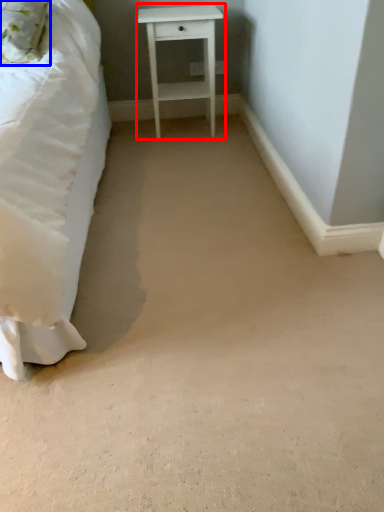
Question: Which object is closer to the camera taking this photo, nightstand (highlighted by a red box) or pillow (highlighted by a blue box)?

Choices:
 (A) nightstand
 (B) pillow

Answer: (B)